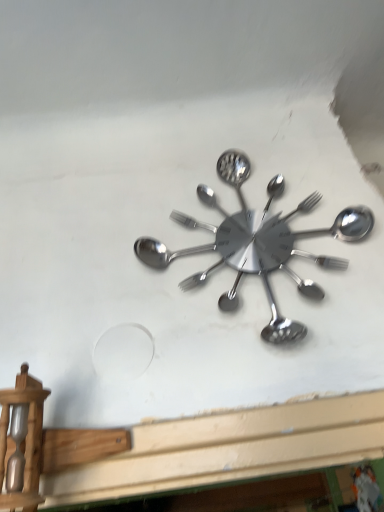
What do you see at coordinates (256, 241) in the screenshot? This screenshot has width=384, height=512. I see `shiny metallic clock at center` at bounding box center [256, 241].

You are a GUI agent. You are given a task and a screenshot of the screen. Output one action in this format:
    pyautogui.click(x=<x>, y=<y>)
    Task: Click on the shiny metallic clock at center
    Image resolution: width=384 pixels, height=512 pixels.
    Given the screenshot: What is the action you would take?
    256,241

At what (x,y) coordinates should I click in order to perform the action: click on shiny metallic clock at center. Please return your answer as a coordinate pair (x, y). The width and height of the screenshot is (384, 512). Looking at the image, I should click on (256, 241).